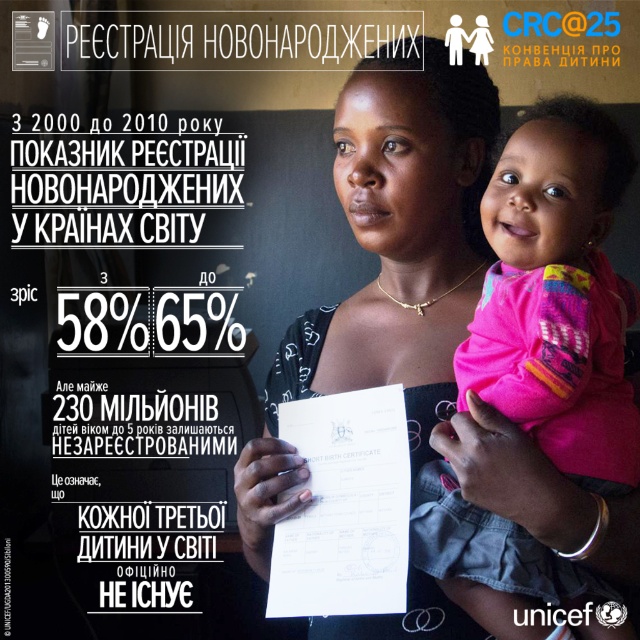
What is located at the coordinates point (557, 296) in the UNICEF poster?

The pink fabric baby at center is located at point (557, 296).

You are a photographer standing at a distance of 4 feet from the UNICEF poster. You want to focus your camera on the point at coordinates point (506, 184). Will your current position allow you to focus on that point effectively?

The distance of point (506, 184) from the camera is 3.71 feet, which is slightly closer than your current position of 4 feet. You may need to move a bit closer to focus effectively on that point.